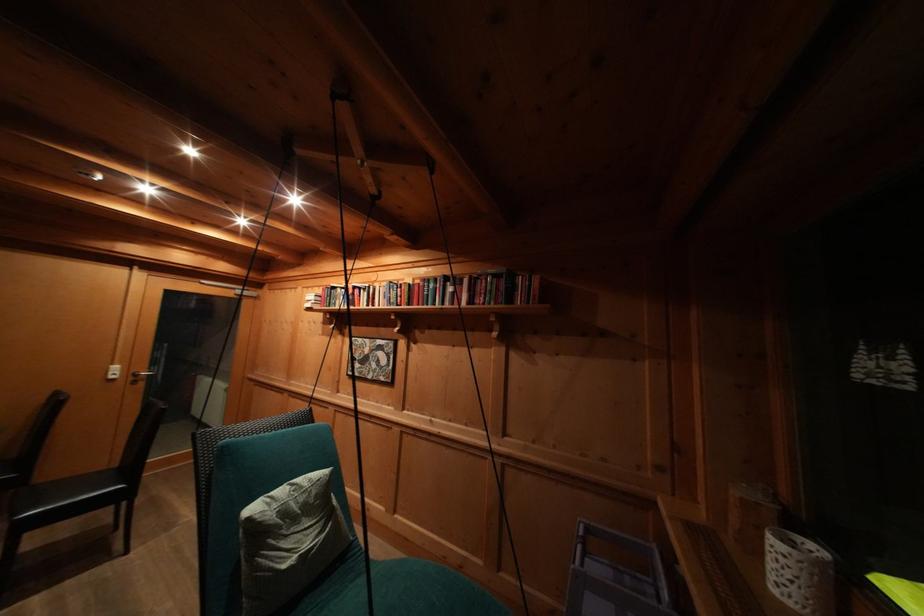
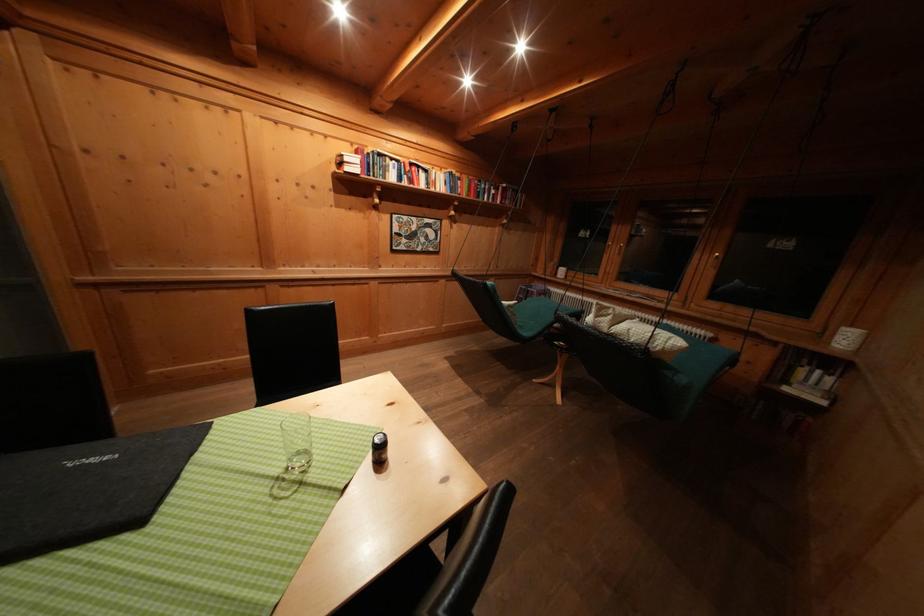
The point at (360, 293) is marked in the first image. Where is the corresponding point in the second image?

(418, 169)